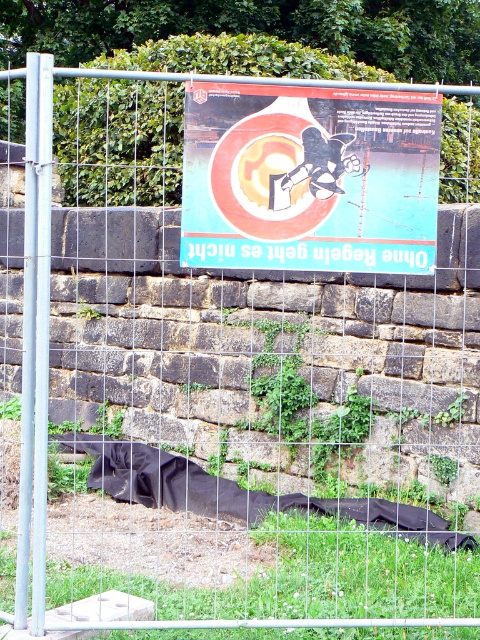
Question: Which point is farther to the camera?

Choices:
 (A) teal paper poster at center
 (B) black fabric blanket at lower left

Answer: (B)

Question: Can you confirm if teal paper poster at center is thinner than black fabric blanket at lower left?

Choices:
 (A) yes
 (B) no

Answer: (A)

Question: Does teal paper poster at center appear under black fabric blanket at lower left?

Choices:
 (A) no
 (B) yes

Answer: (A)

Question: Which of the following is the farthest from the observer?

Choices:
 (A) (430, 532)
 (B) (350, 186)

Answer: (A)

Question: Is teal paper poster at center bigger than black fabric blanket at lower left?

Choices:
 (A) no
 (B) yes

Answer: (A)